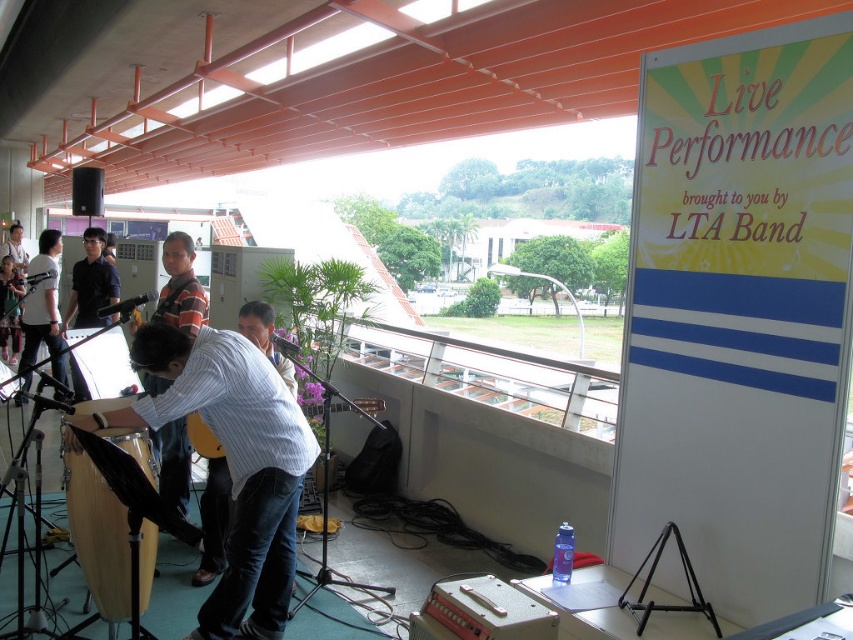
Who is more forward, (271, 353) or (25, 328)?

Point (271, 353)

Identify the location of blue striped shirt at center. (212, 506).

You are a GUI agent. You are given a task and a screenshot of the screen. Output one action in this format:
    pyautogui.click(x=<x>, y=<y>)
    Task: Click on the blue striped shirt at center
    
    Given the screenshot: What is the action you would take?
    pyautogui.click(x=212, y=506)

Between wooden drum at center and matte white shirt at left, which one has more height?

With more height is matte white shirt at left.

Which of these two, wooden drum at center or matte white shirt at left, stands shorter?

wooden drum at center is shorter.

Is point (281, 528) positioned before point (24, 352)?

That is True.

At what (x,y) coordinates should I click in order to perform the action: click on wooden drum at center. Please return your answer as a coordinate pair (x, y). This screenshot has width=853, height=640. Looking at the image, I should click on (231, 461).

In the scene shown: Is wooden drum at lower left above light brown leather guitar at center?

No, wooden drum at lower left is not above light brown leather guitar at center.

Is wooden drum at lower left bigger than light brown leather guitar at center?

Incorrect, wooden drum at lower left is not larger than light brown leather guitar at center.

This screenshot has width=853, height=640. Find the location of `wooden drum at lower left`. wooden drum at lower left is located at coordinates (97, 536).